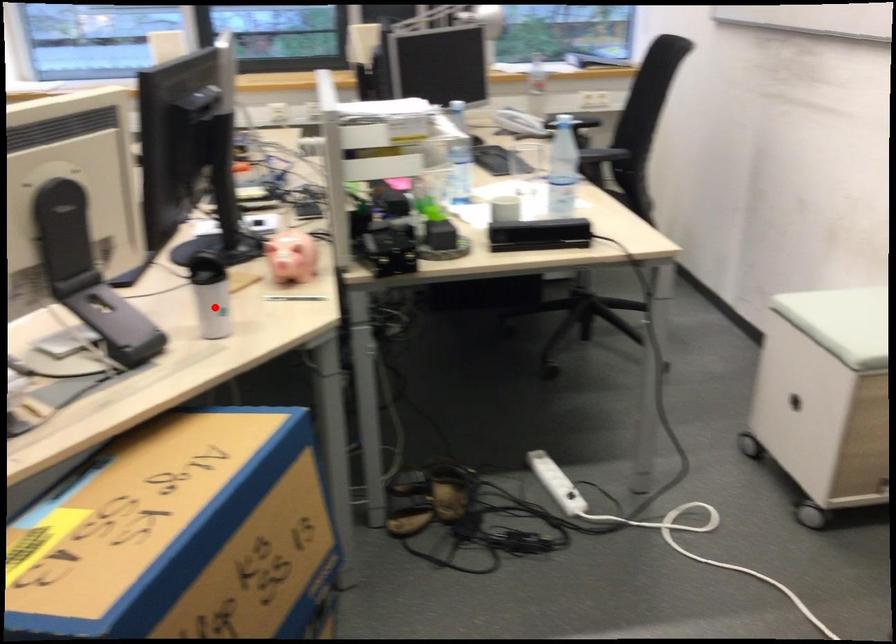
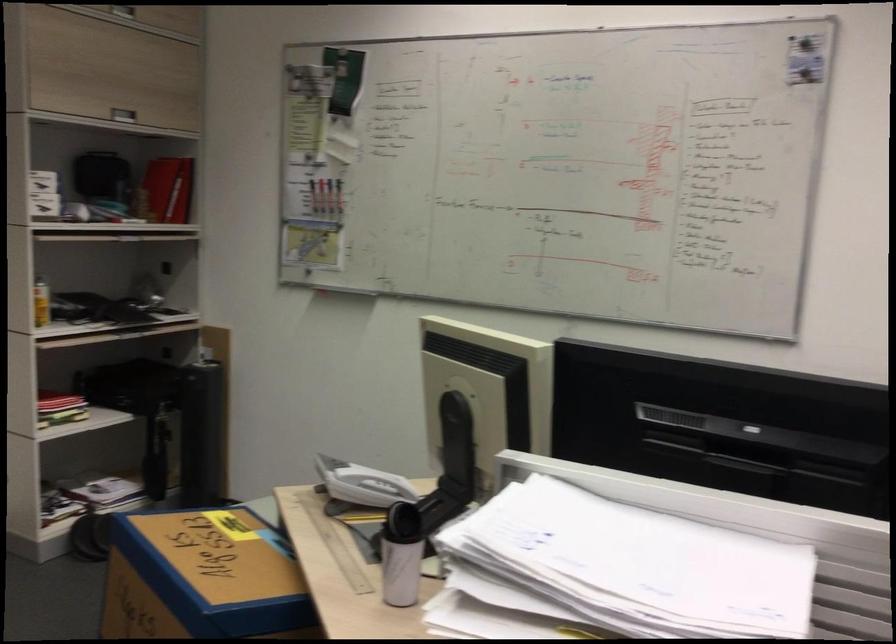
Question: I am providing you with two images of the same scene from different viewpoints. A red point is shown in image1. For the corresponding object point in image2, is it positioned nearer or farther from the camera?

Choices:
 (A) Nearer
 (B) Farther

Answer: (A)